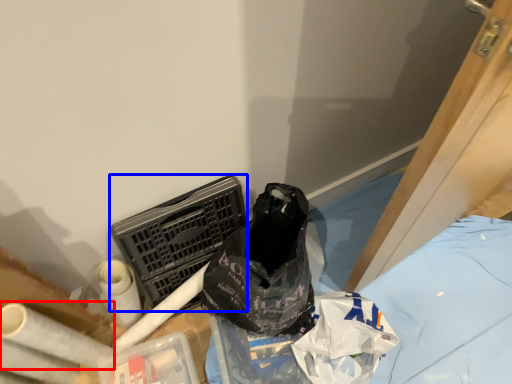
Question: Which of the following is the farthest to the observer, toilet paper (highlighted by a red box) or laundry basket (highlighted by a blue box)?

Choices:
 (A) toilet paper
 (B) laundry basket

Answer: (B)